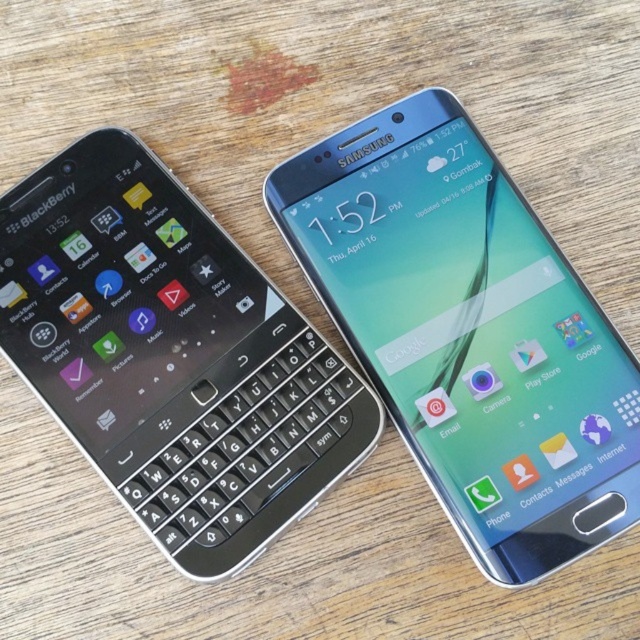
Does sleek silver phone at upper right come behind black plastic keyboard at left?

No, sleek silver phone at upper right is in front of black plastic keyboard at left.

Between sleek silver phone at upper right and black plastic keyboard at left, which one is positioned higher?

sleek silver phone at upper right is above.

What are the coordinates of `sleek silver phone at upper right` in the screenshot? It's located at (468, 332).

At what (x,y) coordinates should I click in order to perform the action: click on sleek silver phone at upper right. Please return your answer as a coordinate pair (x, y). The image size is (640, 640). Looking at the image, I should click on (468, 332).